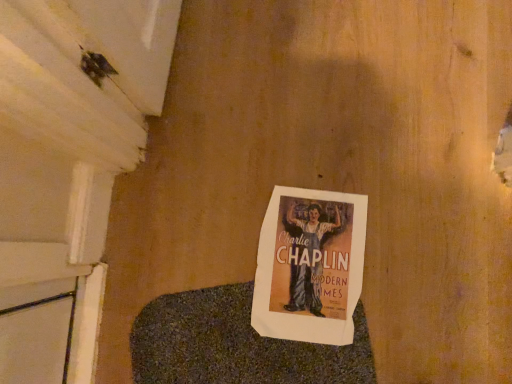
Where is `free point behind matte paper poster at center`? This screenshot has height=384, width=512. free point behind matte paper poster at center is located at coordinates coord(284,156).